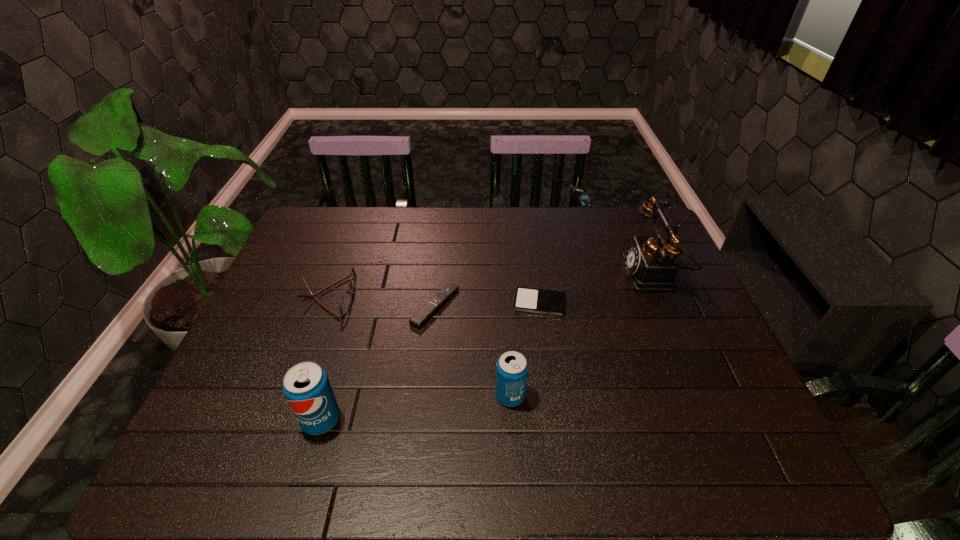
Identify the location of free point that keeps the soda cans evenly spaced on the right. The height and width of the screenshot is (540, 960). (684, 374).